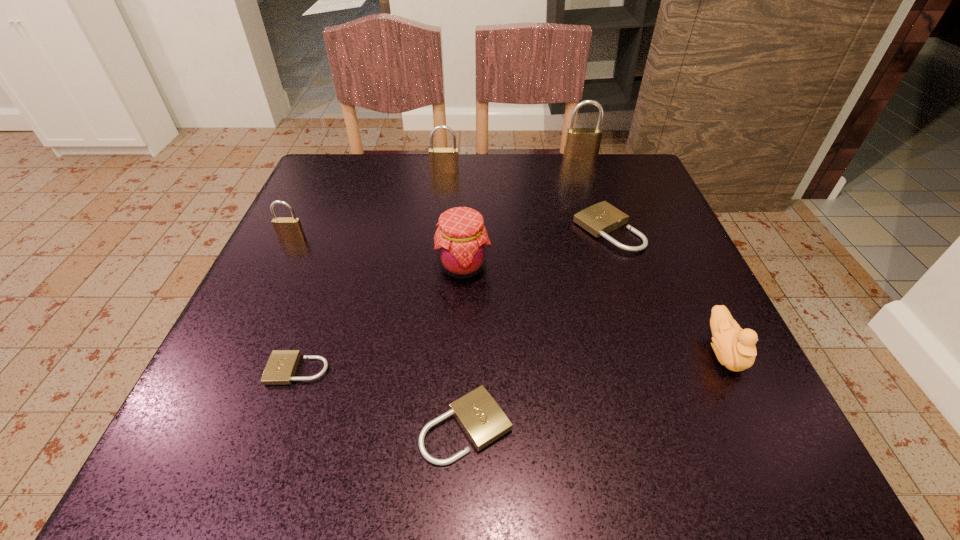
Find the location of a particular element. The image size is (960, 540). blank space located 0.140m on the back of the leftmost beige padlock is located at coordinates (326, 291).

Locate an element on the screen. The image size is (960, 540). object that is positioned at the near edge is located at coordinates (479, 415).

At what (x,y) coordinates should I click in order to perform the action: click on duckling located at the right edge. Please return your answer as a coordinate pair (x, y). Looking at the image, I should click on (735, 349).

Find the location of `vacant space at the far edge of the desktop`. vacant space at the far edge of the desktop is located at coordinates (498, 206).

Image resolution: width=960 pixels, height=540 pixels. Find the location of `free space at the near edge of the desktop`. free space at the near edge of the desktop is located at coordinates (562, 446).

In the image, there is a desktop. Identify the location of free space at the left edge. The width and height of the screenshot is (960, 540). point(312,299).

Locate an element on the screen. vacant space at the right edge of the desktop is located at coordinates (666, 213).

Image resolution: width=960 pixels, height=540 pixels. In order to click on free space at the far left corner of the desktop in this screenshot , I will do `click(353, 161)`.

Where is `free space at the far right corner`? free space at the far right corner is located at coordinates (594, 179).

Identify the location of vacant area that lies between the fourth shortest padlock and the jam. (377, 252).